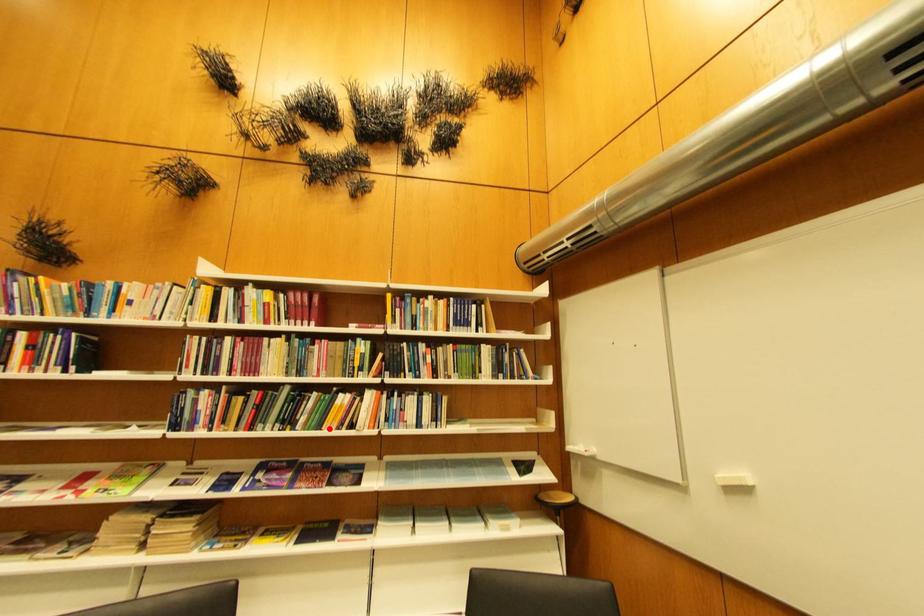
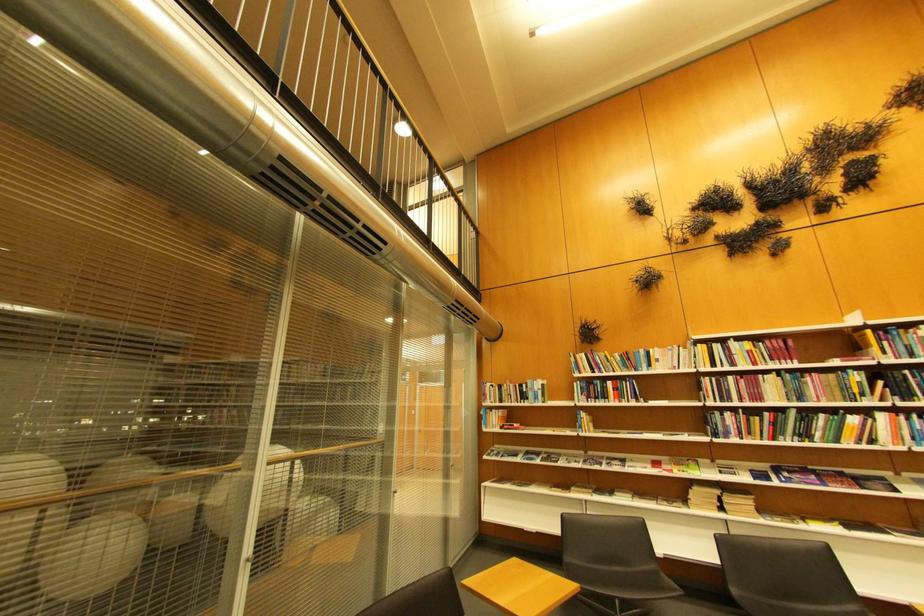
The point at the highlighted location is marked in the first image. Where is the corresponding point in the second image?

(847, 443)